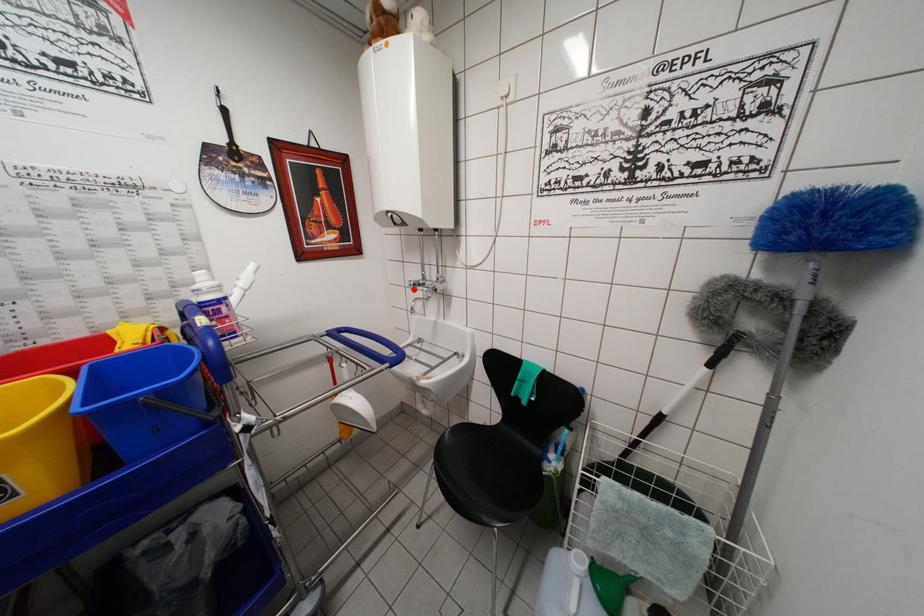
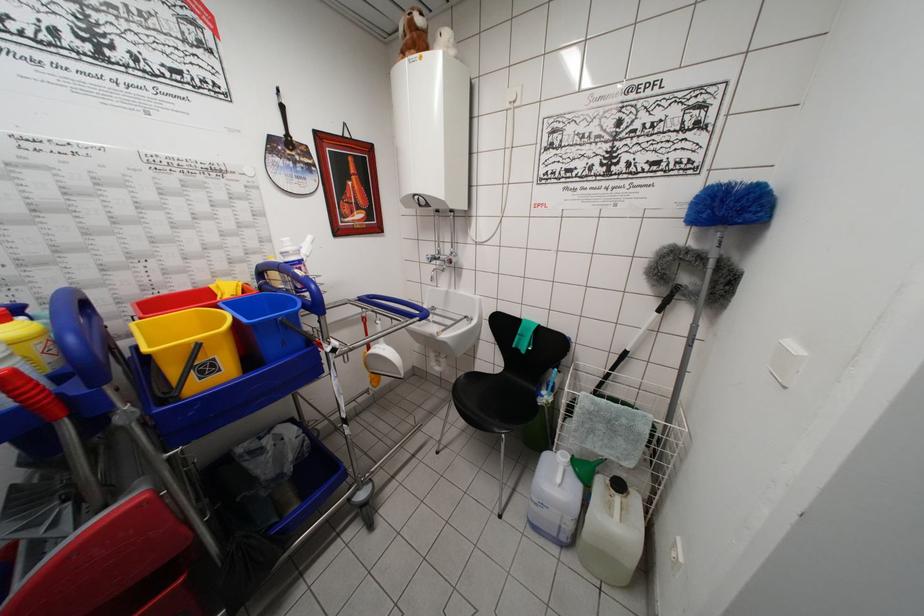
Where in the second image is the point corresponding to the highlighted location from the first image?

(432, 262)